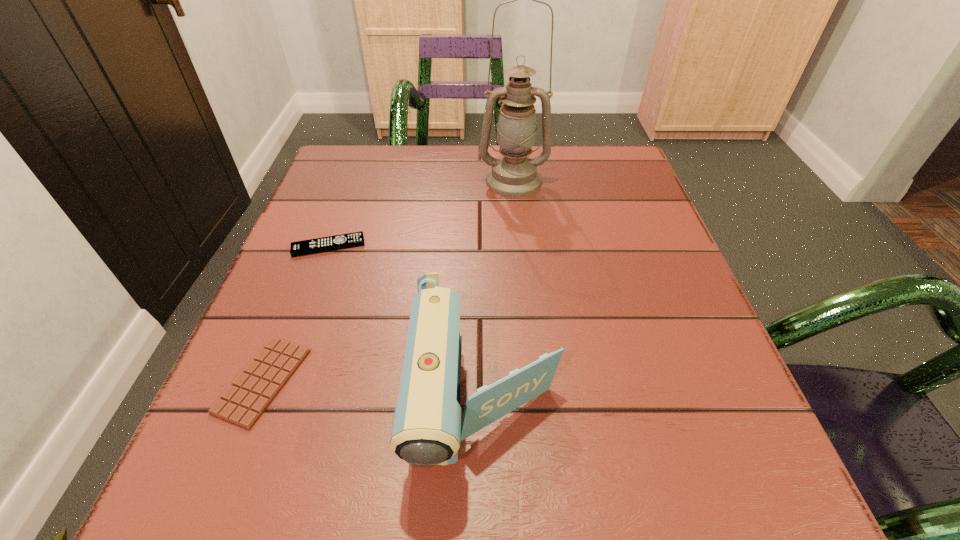
What are the coordinates of `free spot between the farthest object and the candy bar` in the screenshot? It's located at (388, 281).

Where is `free space between the remote control and the camcorder`? The image size is (960, 540). free space between the remote control and the camcorder is located at coordinates (407, 325).

Find the location of a particular element. Image resolution: width=960 pixels, height=540 pixels. free space between the camcorder and the remote control is located at coordinates (407, 325).

Locate an element on the screen. empty space between the tallest object and the shortest object is located at coordinates (388, 281).

Where is `free spot between the remote control and the third shortest object`? free spot between the remote control and the third shortest object is located at coordinates (407, 325).

This screenshot has width=960, height=540. Find the location of `free space between the tallest object and the candy bar`. free space between the tallest object and the candy bar is located at coordinates (388, 281).

This screenshot has width=960, height=540. What are the coordinates of `empty space that is in between the camcorder and the farthest object` in the screenshot? It's located at (499, 292).

Where is `free space between the shortest object and the oil lamp`? This screenshot has height=540, width=960. free space between the shortest object and the oil lamp is located at coordinates pos(388,281).

The width and height of the screenshot is (960, 540). In order to click on free space between the third tallest object and the camcorder in this screenshot , I will do `click(407, 325)`.

Select which object is the third closest to the tallest object. Please provide its 2D coordinates. Your answer should be formatted as a tuple, i.e. [(x, y)], where the tuple contains the x and y coordinates of a point satisfying the conditions above.

[(243, 403)]